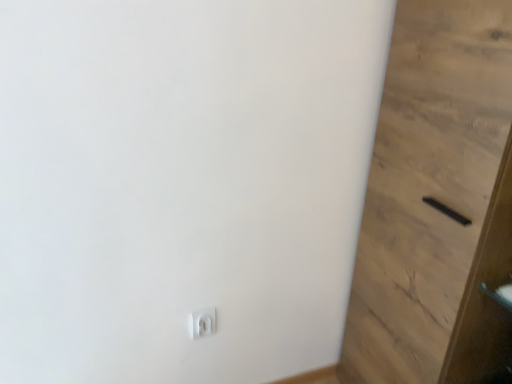
Question: From the image's perspective, is black matte door at lower right located above or below white plastic light switch at lower center?

Choices:
 (A) below
 (B) above

Answer: (B)

Question: From a real-world perspective, is black matte door at lower right positioned above or below white plastic light switch at lower center?

Choices:
 (A) above
 (B) below

Answer: (A)

Question: Based on their positions, is black matte door at lower right located to the left or right of white plastic light switch at lower center?

Choices:
 (A) left
 (B) right

Answer: (B)

Question: Is white plastic light switch at lower center bigger or smaller than black matte door at lower right?

Choices:
 (A) big
 (B) small

Answer: (B)

Question: Is white plastic light switch at lower center situated inside black matte door at lower right or outside?

Choices:
 (A) outside
 (B) inside

Answer: (A)

Question: Is white plastic light switch at lower center taller or shorter than black matte door at lower right?

Choices:
 (A) short
 (B) tall

Answer: (A)

Question: From the image's perspective, is white plastic light switch at lower center above or below black matte door at lower right?

Choices:
 (A) below
 (B) above

Answer: (A)